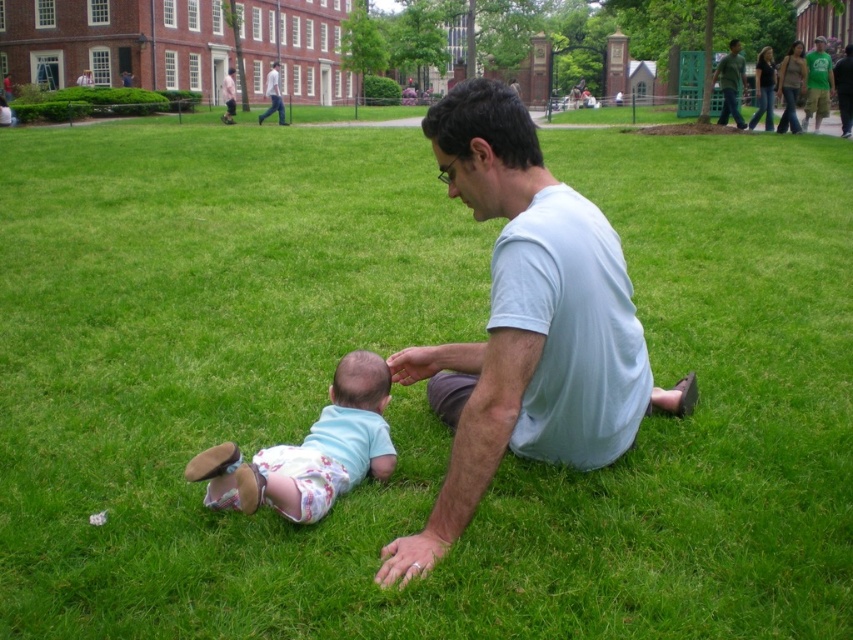
Question: Which object is positioned farthest from the pink fabric shirt at upper center?

Choices:
 (A) light blue fabric baby at center
 (B) green t-shirt at upper right
 (C) light blue cotton shirt at center
 (D) green cotton shirt at upper right

Answer: (C)

Question: Among these objects, which one is nearest to the camera?

Choices:
 (A) light blue fabric baby at center
 (B) green cotton shirt at upper right
 (C) pink fabric shirt at upper center
 (D) green t-shirt at upper right

Answer: (A)

Question: Can you confirm if green t-shirt at upper right is positioned above light blue shirt at center?

Choices:
 (A) no
 (B) yes

Answer: (A)

Question: Can you confirm if light blue cotton shirt at center is positioned above green cotton shirt at upper right?

Choices:
 (A) yes
 (B) no

Answer: (B)

Question: Which point appears farthest from the camera in this image?

Choices:
 (A) (231, 84)
 (B) (268, 74)

Answer: (B)

Question: Can you confirm if light blue cotton shirt at center is thinner than pink fabric shirt at upper center?

Choices:
 (A) no
 (B) yes

Answer: (B)